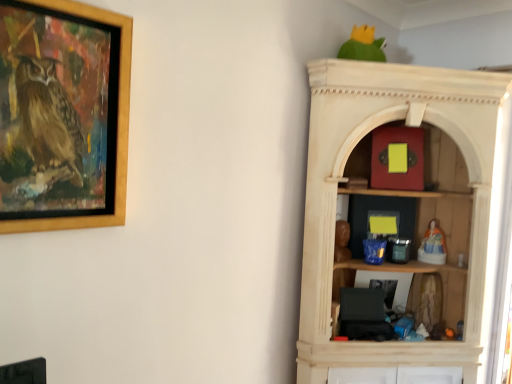
Question: Does fuzzy fabric doll at right, which is the second toy from right to left, come in front of matte red box at upper center, acting as the second toy starting from the left?

Choices:
 (A) yes
 (B) no

Answer: (B)

Question: Can you confirm if fuzzy fabric doll at right, which is the second toy from right to left, is bigger than matte red box at upper center, acting as the second toy starting from the left?

Choices:
 (A) yes
 (B) no

Answer: (B)

Question: Is fuzzy fabric doll at right, the 4th toy from the top, facing away from matte red box at upper center, acting as the second toy starting from the left?

Choices:
 (A) no
 (B) yes

Answer: (A)

Question: From a real-world perspective, is fuzzy fabric doll at right, placed as the 3th toy when sorted from left to right, under matte red box at upper center, marked as the 3th toy in a right-to-left arrangement?

Choices:
 (A) yes
 (B) no

Answer: (A)

Question: Can you confirm if fuzzy fabric doll at right, the 4th toy from the top, is taller than matte red box at upper center, which is the first toy from top to bottom?

Choices:
 (A) yes
 (B) no

Answer: (B)

Question: In terms of height, does matte red box at upper center, the 4th toy ordered from the bottom, look taller or shorter compared to porcelain figurine at right, arranged as the first toy when viewed from the right?

Choices:
 (A) short
 (B) tall

Answer: (B)

Question: Choose the correct answer: Is matte red box at upper center, acting as the second toy starting from the left, inside porcelain figurine at right, which ranks as the 4th toy in left-to-right order, or outside it?

Choices:
 (A) inside
 (B) outside

Answer: (B)

Question: Based on their positions, is matte red box at upper center, the 4th toy ordered from the bottom, located to the left or right of porcelain figurine at right, arranged as the first toy when viewed from the right?

Choices:
 (A) left
 (B) right

Answer: (A)

Question: Is matte red box at upper center, marked as the 3th toy in a right-to-left arrangement, wider or thinner than porcelain figurine at right, arranged as the first toy when viewed from the right?

Choices:
 (A) wide
 (B) thin

Answer: (B)

Question: Is porcelain figurine at right, arranged as the first toy when viewed from the right, inside the boundaries of green matte parrot at upper center, or outside?

Choices:
 (A) inside
 (B) outside

Answer: (B)

Question: Considering the positions of porcelain figurine at right, positioned as the third toy in top-to-bottom order, and green matte parrot at upper center in the image, is porcelain figurine at right, positioned as the third toy in top-to-bottom order, bigger or smaller than green matte parrot at upper center?

Choices:
 (A) small
 (B) big

Answer: (A)

Question: Looking at their shapes, would you say porcelain figurine at right, which ranks as the 4th toy in left-to-right order, is wider or thinner than green matte parrot at upper center?

Choices:
 (A) thin
 (B) wide

Answer: (A)

Question: Is point (435, 259) closer or farther from the camera than point (354, 43)?

Choices:
 (A) farther
 (B) closer

Answer: (A)

Question: Choose the correct answer: Is wooden picture frame at upper left inside porcelain figurine at right, marked as the second toy in a bottom-to-top arrangement, or outside it?

Choices:
 (A) outside
 (B) inside

Answer: (A)

Question: Is point (114, 142) positioned closer to the camera than point (422, 241)?

Choices:
 (A) farther
 (B) closer

Answer: (B)